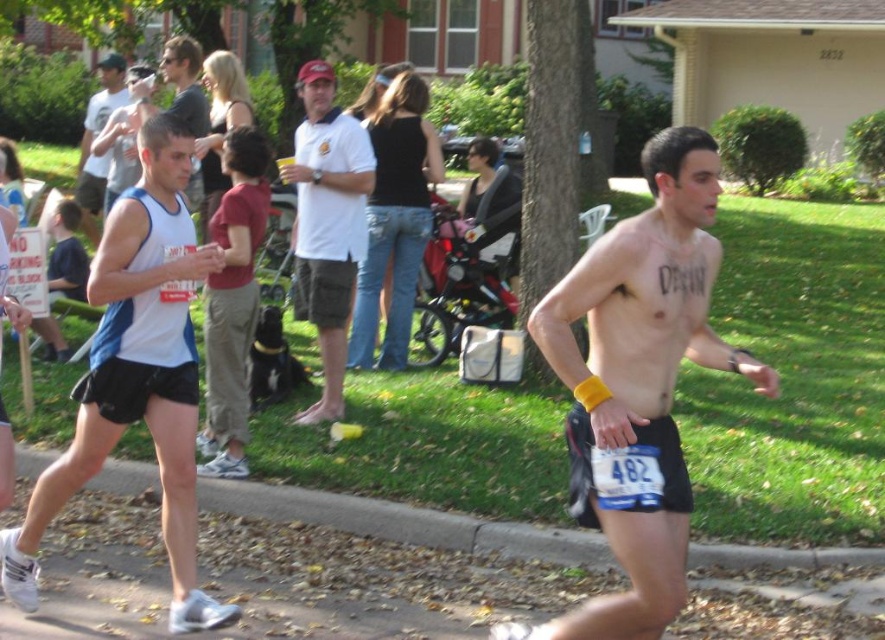
Question: Among these objects, which one is farthest from the camera?

Choices:
 (A) matte white tank top at left
 (B) white cotton shirt at center

Answer: (A)

Question: Among these points, which one is nearest to the camera?

Choices:
 (A) (673, 588)
 (B) (95, 104)
 (C) (127, 118)

Answer: (A)

Question: Observing the image, what is the correct spatial positioning of shiny black shorts at center in reference to matte white tank top at left?

Choices:
 (A) below
 (B) above

Answer: (A)

Question: Is white cotton shirt at center to the right of black denim jeans at center from the viewer's perspective?

Choices:
 (A) no
 (B) yes

Answer: (A)

Question: Which point is closer to the camera?

Choices:
 (A) (319, 77)
 (B) (186, 88)
 (C) (83, 211)
 (D) (668, 147)

Answer: (D)

Question: Observing the image, what is the correct spatial positioning of shiny black shorts at center in reference to white cotton shirt at center?

Choices:
 (A) right
 (B) left

Answer: (A)